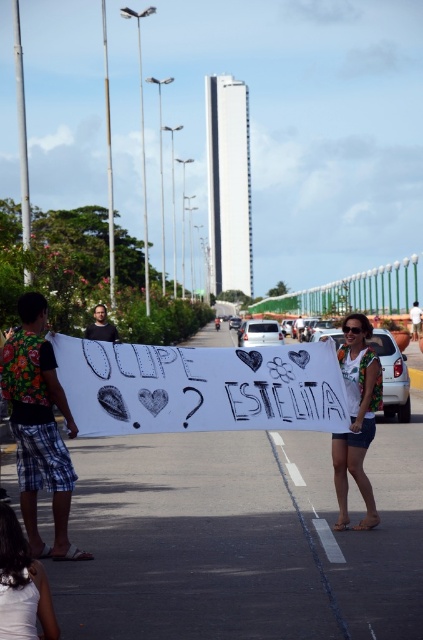
You are standing on the road in the image and want to reach the point marked as point (354, 477). If you can walk 1 meter per second, how long will it take you to reach that point?

The distance of point (354, 477) from viewer is 8.45 meters. At a walking speed of 1 meter per second, it would take approximately 8.45 seconds to reach the point.

You are a pedestrian standing on the road in the image. You see a point at coordinates (357,417). What does this point indicate?

The point at coordinates (357,417) indicates the location of the white fabric sign at center.